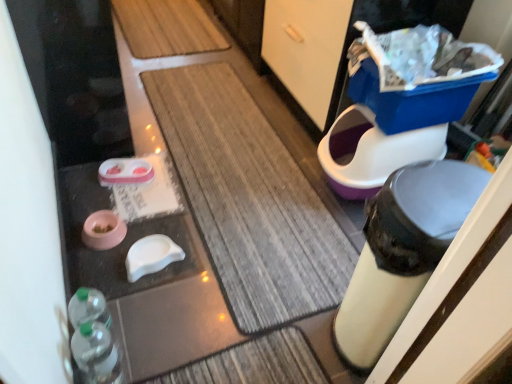
Question: Is pink matte pet food bowl at lower left, marked as the second potty in a right-to-left arrangement, oriented towards translucent plastic bottles at lower left?

Choices:
 (A) yes
 (B) no

Answer: (B)

Question: Considering the relative sizes of pink matte pet food bowl at lower left, arranged as the second potty when viewed from the top, and translucent plastic bottles at lower left in the image provided, is pink matte pet food bowl at lower left, arranged as the second potty when viewed from the top, thinner than translucent plastic bottles at lower left?

Choices:
 (A) yes
 (B) no

Answer: (B)

Question: Is pink matte pet food bowl at lower left, arranged as the second potty when viewed from the top, shorter than translucent plastic bottles at lower left?

Choices:
 (A) no
 (B) yes

Answer: (B)

Question: Is pink matte pet food bowl at lower left, marked as the second potty in a right-to-left arrangement, facing away from translucent plastic bottles at lower left?

Choices:
 (A) yes
 (B) no

Answer: (B)

Question: From the image's perspective, is pink matte pet food bowl at lower left, marked as the second potty in a right-to-left arrangement, located beneath translucent plastic bottles at lower left?

Choices:
 (A) no
 (B) yes

Answer: (A)

Question: From the image's perspective, is textured brown bath mat at center positioned above or below translucent plastic bottles at lower left?

Choices:
 (A) above
 (B) below

Answer: (A)

Question: In terms of height, does textured brown bath mat at center look taller or shorter compared to translucent plastic bottles at lower left?

Choices:
 (A) tall
 (B) short

Answer: (B)

Question: Is textured brown bath mat at center spatially inside translucent plastic bottles at lower left, or outside of it?

Choices:
 (A) outside
 (B) inside

Answer: (A)

Question: From a real-world perspective, is textured brown bath mat at center positioned above or below translucent plastic bottles at lower left?

Choices:
 (A) below
 (B) above

Answer: (A)

Question: Is blue plastic potty at right, the 2th potty from the left, wider or thinner than pink matte pet food bowl at lower left, arranged as the second potty when viewed from the top?

Choices:
 (A) thin
 (B) wide

Answer: (B)

Question: Is blue plastic potty at right, the first potty viewed from the top, to the left or to the right of pink matte pet food bowl at lower left, arranged as the second potty when viewed from the top, in the image?

Choices:
 (A) left
 (B) right

Answer: (B)

Question: Is blue plastic potty at right, the 2th potty from the left, inside or outside of pink matte pet food bowl at lower left, the first potty from the bottom?

Choices:
 (A) inside
 (B) outside

Answer: (B)

Question: Considering the positions of blue plastic potty at right, which appears as the 1th potty when viewed from the right, and pink matte pet food bowl at lower left, which appears as the first potty when viewed from the left, in the image, is blue plastic potty at right, which appears as the 1th potty when viewed from the right, taller or shorter than pink matte pet food bowl at lower left, which appears as the first potty when viewed from the left,?

Choices:
 (A) short
 (B) tall

Answer: (B)

Question: Would you say translucent plastic bottles at lower left is to the left or to the right of blue plastic potty at right, which appears as the 1th potty when viewed from the right, in the picture?

Choices:
 (A) left
 (B) right

Answer: (A)

Question: Is translucent plastic bottles at lower left taller or shorter than blue plastic potty at right, the 2th potty from the left?

Choices:
 (A) short
 (B) tall

Answer: (B)